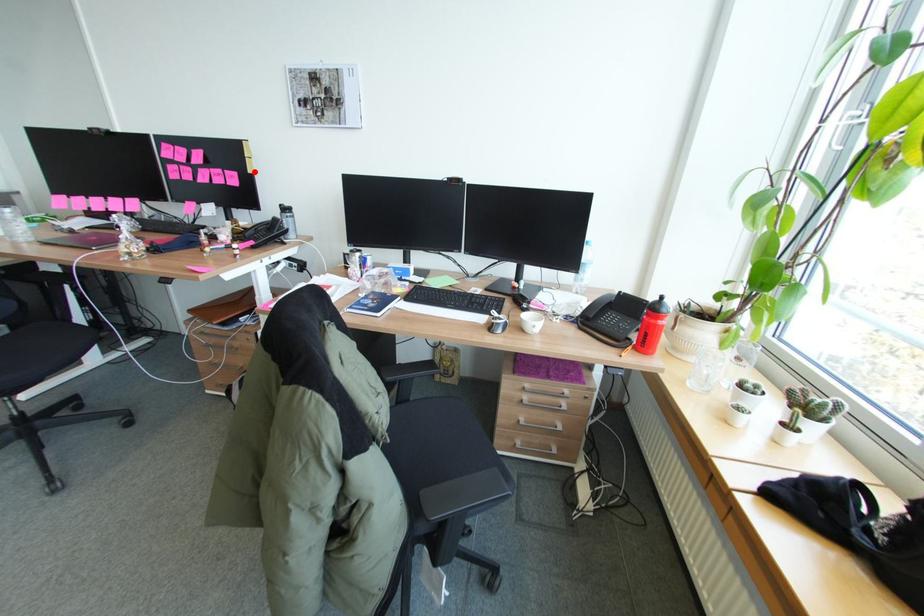
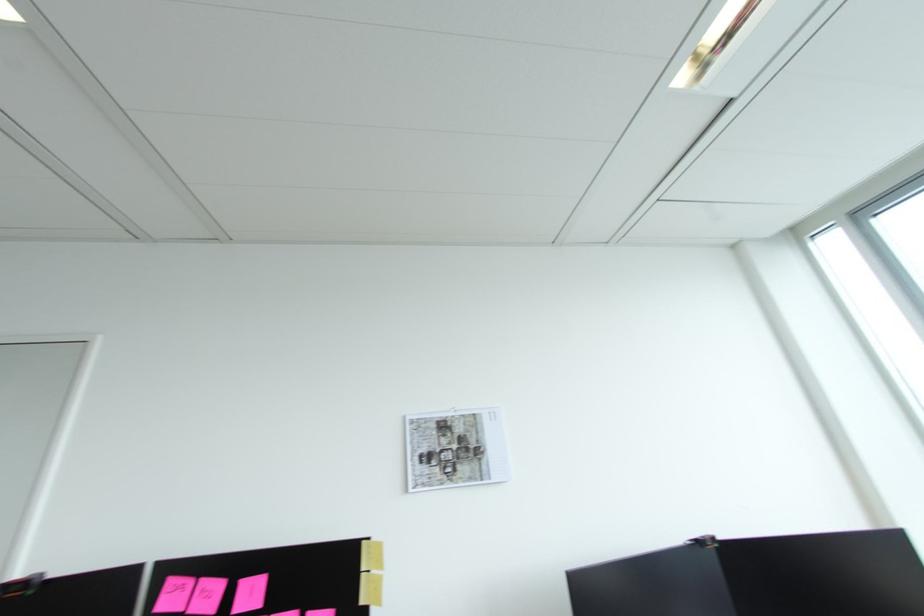
Locate, in the second image, the point that corresponds to the highlighted location in the first image.

(366, 602)